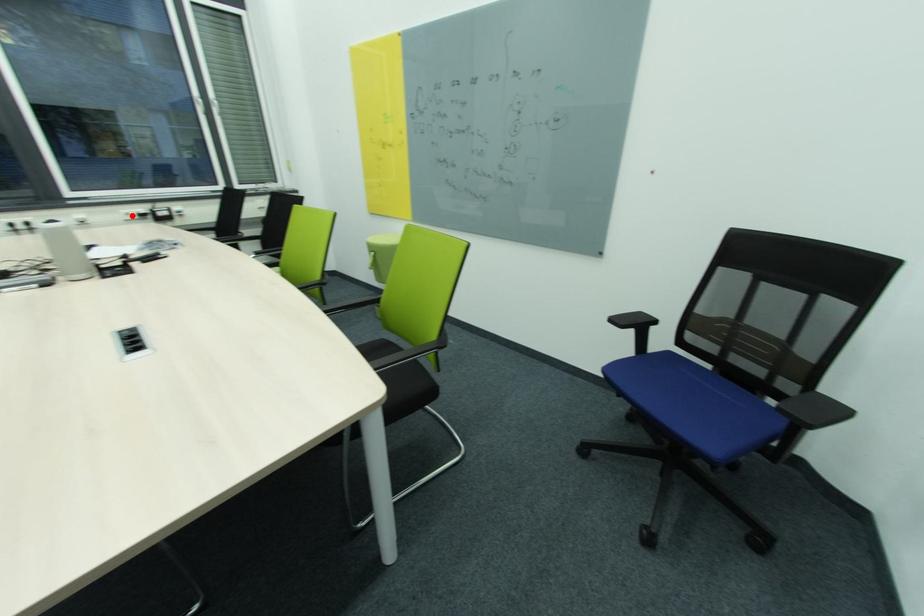
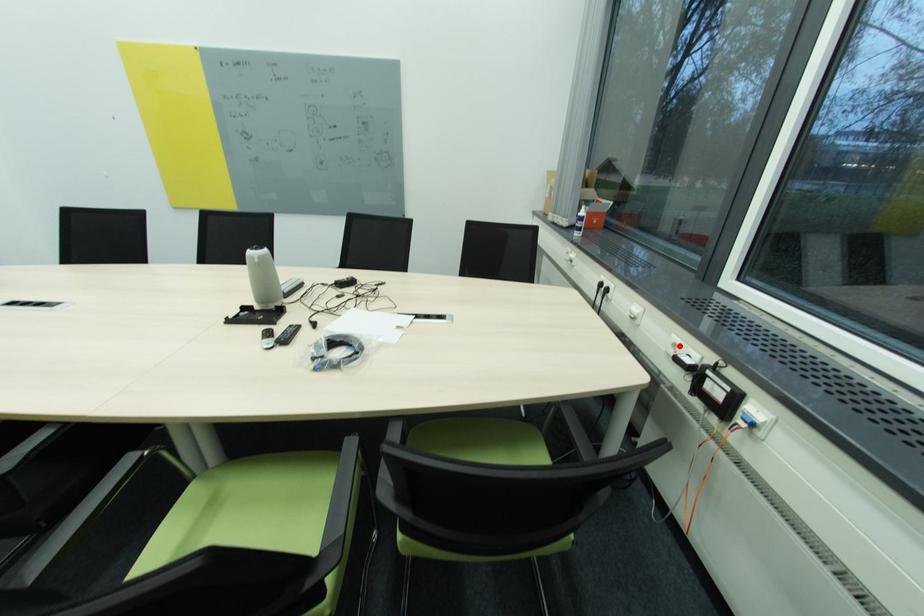
I am providing you with two images of the same scene from different viewpoints. A red point is marked on the first image and another point is marked on the second image. Is the marked point in image1 the same physical position as the marked point in image2?

Yes